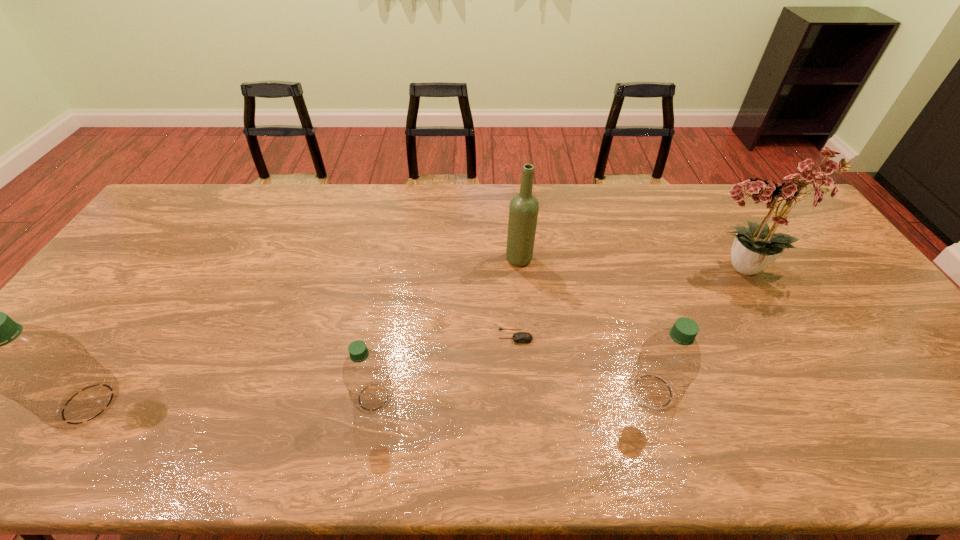
Where is `free spot between the wine bottle and the fifth object from right to left`? The height and width of the screenshot is (540, 960). free spot between the wine bottle and the fifth object from right to left is located at coordinates (446, 328).

The height and width of the screenshot is (540, 960). Identify the location of free point between the fourth tallest object and the second shortest object. (514, 394).

At what (x,y) coordinates should I click in order to perform the action: click on vacant area that lies between the wine bottle and the second water bottle from right to left. Please return your answer as a coordinate pair (x, y). The height and width of the screenshot is (540, 960). Looking at the image, I should click on (446, 328).

Identify the location of the third closest object relative to the wine bottle. (365, 374).

Identify which object is the fourth closest to the second tallest water bottle. Please provide its 2D coordinates. Your answer should be formatted as a tuple, i.e. [(x, y)], where the tuple contains the x and y coordinates of a point satisfying the conditions above.

[(365, 374)]

Identify which water bottle is the third closest to the wine bottle. Please provide its 2D coordinates. Your answer should be formatted as a tuple, i.e. [(x, y)], where the tuple contains the x and y coordinates of a point satisfying the conditions above.

[(48, 372)]

Identify which water bottle is the second closest to the second shortest object. Please provide its 2D coordinates. Your answer should be formatted as a tuple, i.e. [(x, y)], where the tuple contains the x and y coordinates of a point satisfying the conditions above.

[(669, 361)]